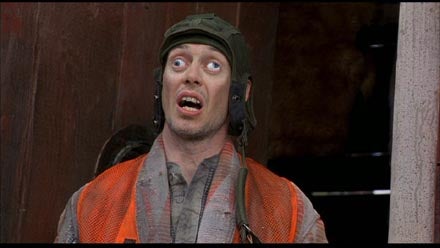
Where is `light colored wooded board`? Image resolution: width=440 pixels, height=248 pixels. light colored wooded board is located at coordinates (428, 144).